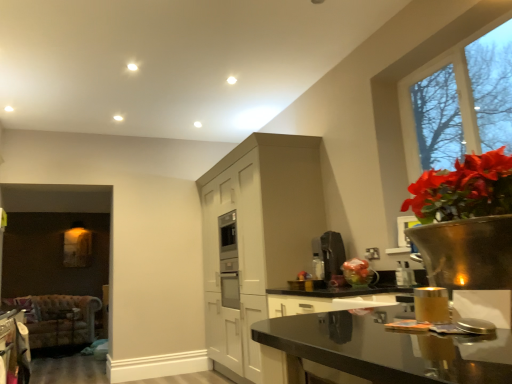
What do you see at coordinates (255, 237) in the screenshot?
I see `white matte cabinetry at center` at bounding box center [255, 237].

Measure the distance between clear glass window at upper right and camera.

clear glass window at upper right and camera are 7.88 feet apart.

Where is `gold metallic candle holder at lower right`? gold metallic candle holder at lower right is located at coordinates (431, 305).

Measure the distance between velvet-patterned armchair at lower left and camera.

velvet-patterned armchair at lower left and camera are 18.45 feet apart from each other.

Measure the distance between point (333, 246) and camera.

They are 3.32 meters apart.

This screenshot has height=384, width=512. Describe the element at coordinates (404, 275) in the screenshot. I see `satin silver coffee maker at upper right, marked as the 2th appliance in a left-to-right arrangement` at that location.

This screenshot has height=384, width=512. In order to click on white matte cabinetry at center in this screenshot , I will do `click(255, 237)`.

From a real-world perspective, who is located higher, satin silver coffee maker at upper right, the second appliance positioned from the back, or gold metallic candle holder at lower right?

satin silver coffee maker at upper right, the second appliance positioned from the back.

Considering the sizes of objects satin silver coffee maker at upper right, the second appliance positioned from the back, and gold metallic candle holder at lower right in the image provided, who is wider, satin silver coffee maker at upper right, the second appliance positioned from the back, or gold metallic candle holder at lower right?

gold metallic candle holder at lower right.

What's the angular difference between satin silver coffee maker at upper right, marked as the 2th appliance in a left-to-right arrangement, and gold metallic candle holder at lower right's facing directions?

The angular difference between satin silver coffee maker at upper right, marked as the 2th appliance in a left-to-right arrangement, and gold metallic candle holder at lower right is 75.4 degrees.

The width and height of the screenshot is (512, 384). In the image, there is a satin silver coffee maker at upper right, which is the 1th appliance in right-to-left order. Identify the location of candle holder below it (from a real-world perspective). (431, 305).

Who is taller, black glossy countertop at lower right or white matte cabinetry at center?

With more height is white matte cabinetry at center.

From the picture: From a real-world perspective, is black glossy countertop at lower right positioned under white matte cabinetry at center based on gravity?

Indeed, from a real-world perspective, black glossy countertop at lower right is positioned beneath white matte cabinetry at center.

Is black glossy countertop at lower right positioned far away from white matte cabinetry at center?

black glossy countertop at lower right is far away from white matte cabinetry at center.

In the image, is satin silver coffee maker at upper right, which is the 1th appliance in right-to-left order, on the left side or the right side of velvet-patterned armchair at lower left?

In the image, satin silver coffee maker at upper right, which is the 1th appliance in right-to-left order, appears on the right side of velvet-patterned armchair at lower left.

Can velvet-patterned armchair at lower left be found inside satin silver coffee maker at upper right, which is the 1th appliance in right-to-left order?

Actually, velvet-patterned armchair at lower left is outside satin silver coffee maker at upper right, which is the 1th appliance in right-to-left order.

Find the location of a particular element. The width and height of the screenshot is (512, 384). armchair beneath the satin silver coffee maker at upper right, which is the 1th appliance in right-to-left order (from a real-world perspective) is located at coordinates (58, 318).

Could you tell me if gold metallic candle holder at lower right is turned towards black glossy countertop at lower right?

No, gold metallic candle holder at lower right is not facing towards black glossy countertop at lower right.

Based on their sizes in the image, would you say gold metallic candle holder at lower right is bigger or smaller than black glossy countertop at lower right?

Considering their sizes, gold metallic candle holder at lower right takes up less space than black glossy countertop at lower right.

The height and width of the screenshot is (384, 512). What are the coordinates of `candle holder lying on the left of black glossy countertop at lower right` in the screenshot? It's located at (431, 305).

From a real-world perspective, is gold metallic candle holder at lower right above or below black glossy countertop at lower right?

In terms of real-world spatial position, gold metallic candle holder at lower right is above black glossy countertop at lower right.

From a real-world perspective, which is physically above, gold metallic candle holder at lower right or satin silver coffee maker at upper right, which is the 1th appliance in right-to-left order?

satin silver coffee maker at upper right, which is the 1th appliance in right-to-left order, is physically above.

Does gold metallic candle holder at lower right come in front of satin silver coffee maker at upper right, the second appliance positioned from the back?

Yes, gold metallic candle holder at lower right is closer to the viewer.

Considering the sizes of objects gold metallic candle holder at lower right and satin silver coffee maker at upper right, acting as the first appliance starting from the front, in the image provided, who is taller, gold metallic candle holder at lower right or satin silver coffee maker at upper right, acting as the first appliance starting from the front,?

satin silver coffee maker at upper right, acting as the first appliance starting from the front.

Considering the positions of objects black glossy countertop at lower right and velvet-patterned armchair at lower left in the image provided, who is more to the left, black glossy countertop at lower right or velvet-patterned armchair at lower left?

Positioned to the left is velvet-patterned armchair at lower left.

Does black glossy countertop at lower right touch velvet-patterned armchair at lower left?

No, black glossy countertop at lower right is not touching velvet-patterned armchair at lower left.

Is black glossy countertop at lower right inside or outside of velvet-patterned armchair at lower left?

black glossy countertop at lower right is located beyond the bounds of velvet-patterned armchair at lower left.

Is velvet-patterned armchair at lower left spatially inside black glossy countertop at lower right, or outside of it?

velvet-patterned armchair at lower left is outside black glossy countertop at lower right.

Considering the sizes of velvet-patterned armchair at lower left and black glossy countertop at lower right in the image, is velvet-patterned armchair at lower left wider or thinner than black glossy countertop at lower right?

velvet-patterned armchair at lower left is wider than black glossy countertop at lower right.

Does point (91, 337) lie behind point (373, 338)?

Yes.

Does velvet-patterned armchair at lower left have a smaller size compared to black glossy countertop at lower right?

Actually, velvet-patterned armchair at lower left might be larger than black glossy countertop at lower right.

You are a GUI agent. You are given a task and a screenshot of the screen. Output one action in this format:
    pyautogui.click(x=<x>, y=<y>)
    Task: Click on the candle holder on the left of satin silver coffee maker at upper right, marked as the 2th appliance in a left-to-right arrangement
    
    Given the screenshot: What is the action you would take?
    pyautogui.click(x=431, y=305)

Image resolution: width=512 pixels, height=384 pixels. Find the location of `countertop in front of the white matte cabinetry at center`. countertop in front of the white matte cabinetry at center is located at coordinates [377, 351].

Based on their spatial positions, is satin silver coffee maker at upper right, the second appliance positioned from the back, or white matte cabinetry at center closer to gold metallic candle holder at lower right?

satin silver coffee maker at upper right, the second appliance positioned from the back, is positioned closer to the anchor gold metallic candle holder at lower right.

Which object lies further to the anchor point black glossy countertop at lower right, satin black coffee machine at center, which is the 1th appliance in back-to-front order, or white matte cabinetry at center?

white matte cabinetry at center is positioned further to the anchor black glossy countertop at lower right.

Which object lies nearer to the anchor point velvet-patterned armchair at lower left, black glossy countertop at lower right or white matte cabinetry at center?

The object closer to velvet-patterned armchair at lower left is white matte cabinetry at center.

Based on their spatial positions, is clear glass window at upper right or satin black coffee machine at center, acting as the 2th appliance starting from the front, closer to satin silver coffee maker at upper right, marked as the 2th appliance in a left-to-right arrangement?

Among the two, satin black coffee machine at center, acting as the 2th appliance starting from the front, is located nearer to satin silver coffee maker at upper right, marked as the 2th appliance in a left-to-right arrangement.

Looking at this image, when comparing their distances from satin black coffee machine at center, acting as the 2th appliance starting from the front, does black glossy countertop at lower right or velvet-patterned armchair at lower left seem closer?

black glossy countertop at lower right.

Based on their spatial positions, is black glossy countertop at lower right or gold metallic candle holder at lower right further from velvet-patterned armchair at lower left?

The object further to velvet-patterned armchair at lower left is gold metallic candle holder at lower right.

Which object lies nearer to the anchor point satin black coffee machine at center, which is the 2th appliance in right-to-left order, white matte cabinetry at center or gold metallic candle holder at lower right?

white matte cabinetry at center is positioned closer to the anchor satin black coffee machine at center, which is the 2th appliance in right-to-left order.

Which object lies nearer to the anchor point velvet-patterned armchair at lower left, satin silver coffee maker at upper right, which is the 1th appliance in right-to-left order, or white matte cabinetry at center?

white matte cabinetry at center.

Find the location of `cabinetry between gold metallic candle holder at lower right and velvet-patterned armchair at lower left in the front-back direction`. cabinetry between gold metallic candle holder at lower right and velvet-patterned armchair at lower left in the front-back direction is located at coordinates (255, 237).

This screenshot has height=384, width=512. Identify the location of appliance between black glossy countertop at lower right and white matte cabinetry at center along the z-axis. (404, 275).

What are the coordinates of `appliance located between velvet-patterned armchair at lower left and black glossy countertop at lower right in the left-right direction` in the screenshot? It's located at (332, 254).

Locate an element on the screen. appliance positioned between gold metallic candle holder at lower right and satin black coffee machine at center, acting as the 2th appliance starting from the front, from near to far is located at coordinates (404, 275).